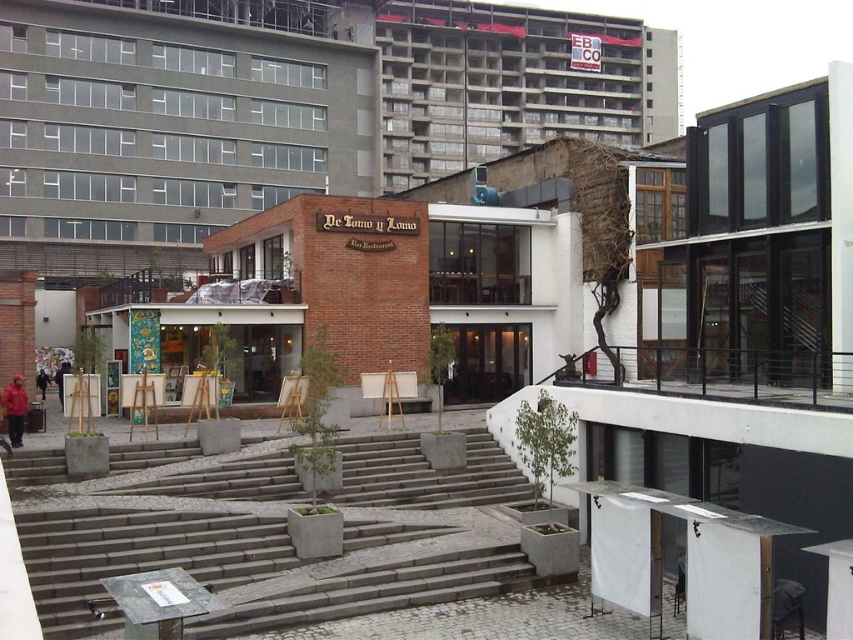
Question: Does gray concrete stairs at center come in front of wooden easel at center?

Choices:
 (A) yes
 (B) no

Answer: (A)

Question: Which object is closer to the camera taking this photo?

Choices:
 (A) gray concrete stairs at center
 (B) wooden easel at center

Answer: (A)

Question: Which point is closer to the camera?

Choices:
 (A) (282, 420)
 (B) (518, 541)

Answer: (B)

Question: Considering the relative positions of gray concrete stairs at center and wooden easel at center in the image provided, where is gray concrete stairs at center located with respect to wooden easel at center?

Choices:
 (A) left
 (B) right

Answer: (B)

Question: Is the position of gray concrete stairs at center less distant than that of wooden easel at center?

Choices:
 (A) no
 (B) yes

Answer: (B)